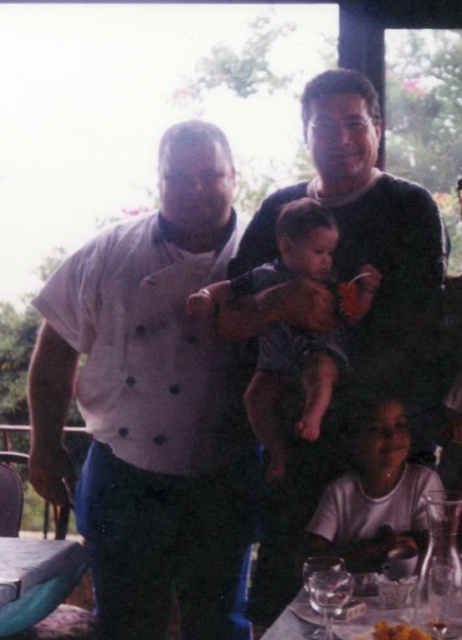
Question: Where is blue denim shorts at center located in relation to yellowish matte food at lower right in the image?

Choices:
 (A) right
 (B) left

Answer: (B)

Question: Among these points, which one is nearest to the camera?

Choices:
 (A) (405, 637)
 (B) (340, 349)
 (C) (177, 353)

Answer: (A)

Question: Where is blue denim shorts at center located in relation to clear glassware at lower center in the image?

Choices:
 (A) right
 (B) left

Answer: (B)

Question: Can you confirm if clear glassware at lower center is bigger than clear glass wine glass at lower center?

Choices:
 (A) no
 (B) yes

Answer: (B)

Question: Estimate the real-world distances between objects in this image. Which object is closer to the clear glassware at lower center?

Choices:
 (A) blue denim shorts at center
 (B) white button-up shirt at left

Answer: (A)

Question: Which object is the farthest from the clear glassware at lower center?

Choices:
 (A) clear glass wine glass at lower center
 (B) white button-up shirt at left
 (C) yellowish matte food at lower right

Answer: (B)